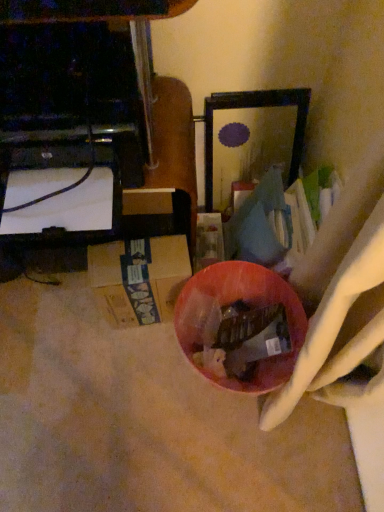
Question: Would you say shiny plastic bowl at center is inside or outside black glossy tv stand at left?

Choices:
 (A) outside
 (B) inside

Answer: (A)

Question: In terms of size, does shiny plastic bowl at center appear bigger or smaller than black glossy tv stand at left?

Choices:
 (A) big
 (B) small

Answer: (B)

Question: From the image's perspective, is shiny plastic bowl at center above or below black glossy tv stand at left?

Choices:
 (A) above
 (B) below

Answer: (B)

Question: In the image, is black glossy tv stand at left on the left side or the right side of shiny plastic bowl at center?

Choices:
 (A) right
 (B) left

Answer: (B)

Question: Is point (39, 22) positioned closer to the camera than point (254, 387)?

Choices:
 (A) closer
 (B) farther

Answer: (A)

Question: From their relative heights in the image, would you say black glossy tv stand at left is taller or shorter than shiny plastic bowl at center?

Choices:
 (A) tall
 (B) short

Answer: (B)

Question: In terms of size, does black glossy tv stand at left appear bigger or smaller than shiny plastic bowl at center?

Choices:
 (A) big
 (B) small

Answer: (A)